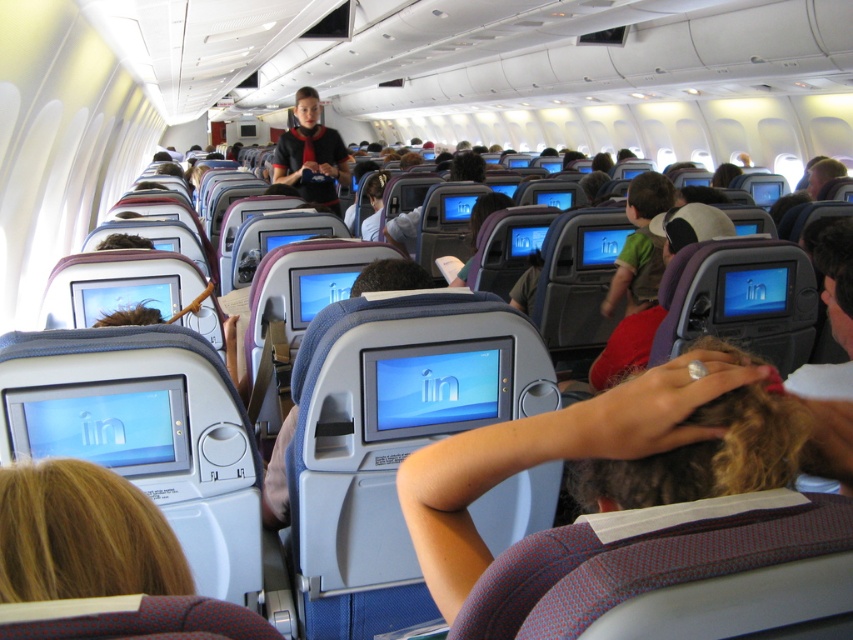
Question: Does dark brown hair at center come in front of matte black uniform at center?

Choices:
 (A) yes
 (B) no

Answer: (A)

Question: Can you confirm if dark brown hair at center is smaller than matte black uniform at center?

Choices:
 (A) no
 (B) yes

Answer: (B)

Question: Where is dark brown hair at center located in relation to matte black uniform at center in the image?

Choices:
 (A) right
 (B) left

Answer: (A)